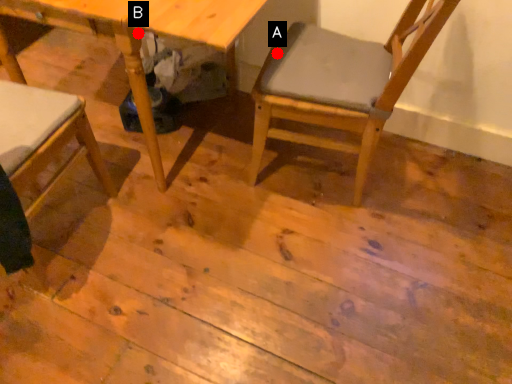
Question: Two points are circled on the image, labeled by A and B beside each circle. Which point is closer to the camera taking this photo?

Choices:
 (A) A is closer
 (B) B is closer

Answer: (B)